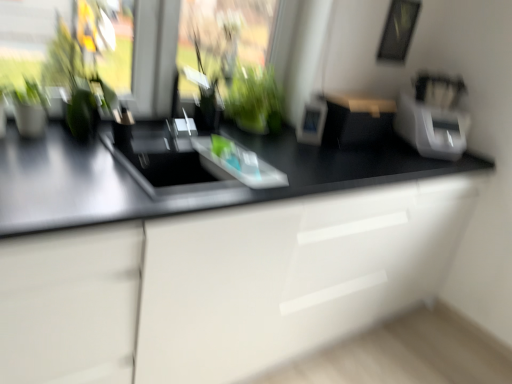
Question: From the image's perspective, is transparent glass window screen at upper left, the 1th window screen viewed from the left, located beneath matte black box at center, which is the 2th appliance in right-to-left order?

Choices:
 (A) no
 (B) yes

Answer: (A)

Question: Is transparent glass window screen at upper left, positioned as the second window screen in right-to-left order, facing towards matte black box at center, the second appliance when ordered from left to right?

Choices:
 (A) yes
 (B) no

Answer: (B)

Question: Considering the relative sizes of transparent glass window screen at upper left, positioned as the second window screen in right-to-left order, and matte black box at center, the second appliance when ordered from left to right, in the image provided, is transparent glass window screen at upper left, positioned as the second window screen in right-to-left order, taller than matte black box at center, the second appliance when ordered from left to right,?

Choices:
 (A) no
 (B) yes

Answer: (B)

Question: Could matte black box at center, the second appliance when ordered from left to right, be considered to be inside transparent glass window screen at upper left, the 1th window screen viewed from the left?

Choices:
 (A) no
 (B) yes

Answer: (A)

Question: Does transparent glass window screen at upper left, the 1th window screen viewed from the left, touch matte black box at center, the second appliance when ordered from left to right?

Choices:
 (A) no
 (B) yes

Answer: (A)

Question: Is matte black box at center, which is the 2th appliance in right-to-left order, spatially inside green glossy plant at center, or outside of it?

Choices:
 (A) outside
 (B) inside

Answer: (A)

Question: Is point (373, 97) positioned closer to the camera than point (248, 99)?

Choices:
 (A) farther
 (B) closer

Answer: (A)

Question: In the image, is matte black box at center, which is the 2th appliance in right-to-left order, positioned in front of or behind green glossy plant at center?

Choices:
 (A) front
 (B) behind

Answer: (B)

Question: Would you say matte black box at center, the second appliance when ordered from left to right, is to the left or to the right of green glossy plant at center in the picture?

Choices:
 (A) right
 (B) left

Answer: (A)

Question: Based on their sizes in the image, would you say matte black box at center, the second appliance when ordered from left to right, is bigger or smaller than transparent glass window screen at upper left, the 1th window screen viewed from the left?

Choices:
 (A) big
 (B) small

Answer: (B)

Question: Looking at their shapes, would you say matte black box at center, which is the 2th appliance in right-to-left order, is wider or thinner than transparent glass window screen at upper left, the 1th window screen viewed from the left?

Choices:
 (A) wide
 (B) thin

Answer: (A)

Question: In the image, is matte black box at center, the second appliance when ordered from left to right, positioned in front of or behind transparent glass window screen at upper left, the 1th window screen viewed from the left?

Choices:
 (A) behind
 (B) front

Answer: (A)

Question: Is matte black box at center, the second appliance when ordered from left to right, spatially inside transparent glass window screen at upper left, the 1th window screen viewed from the left, or outside of it?

Choices:
 (A) outside
 (B) inside

Answer: (A)

Question: Is green glossy plant at center to the left or to the right of white plastic knife block at right, which ranks as the first appliance in right-to-left order, in the image?

Choices:
 (A) left
 (B) right

Answer: (A)

Question: In terms of height, does green glossy plant at center look taller or shorter compared to white plastic knife block at right, which ranks as the first appliance in right-to-left order?

Choices:
 (A) short
 (B) tall

Answer: (A)